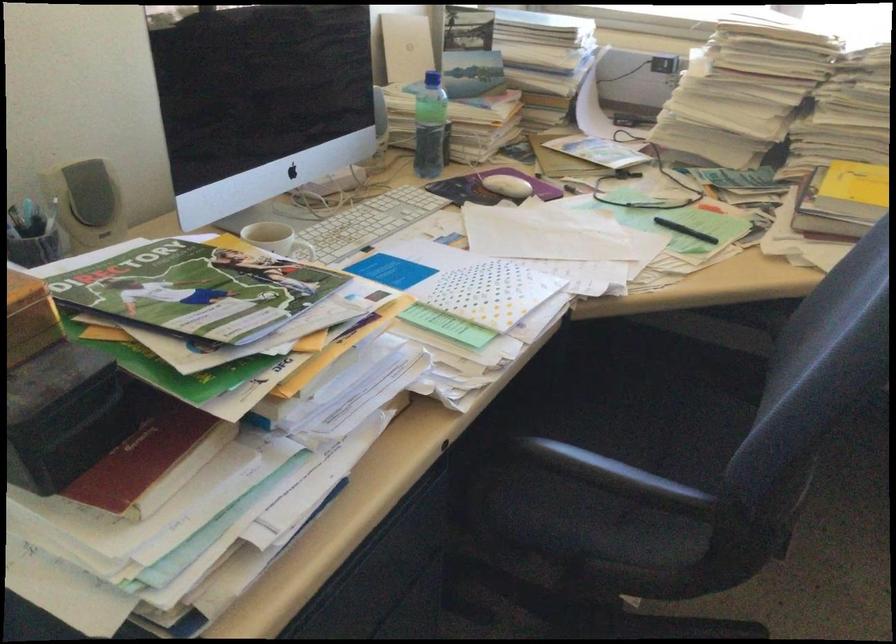
Find where to slid the white computer mouse. Please return your answer as a coordinate pair (x, y).

(506, 185)